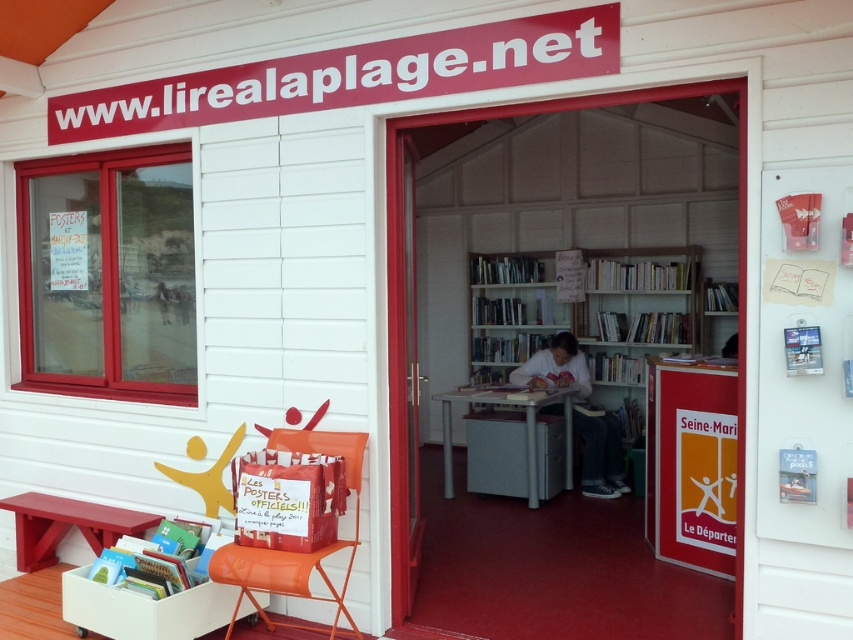
Question: Based on their relative distances, which object is farther from the matte red bench at lower left?

Choices:
 (A) wooden door at center
 (B) red cardboard sign at right
 (C) white wooden bookshelf at center

Answer: (C)

Question: Can you confirm if white wooden bookshelf at center is positioned above red cardboard sign at right?

Choices:
 (A) yes
 (B) no

Answer: (A)

Question: Can you confirm if red cardboard sign at right is positioned to the right of wooden door at center?

Choices:
 (A) no
 (B) yes

Answer: (B)

Question: Estimate the real-world distances between objects in this image. Which object is farther from the red cardboard sign at right?

Choices:
 (A) matte red bench at lower left
 (B) white wooden bookshelf at center

Answer: (A)

Question: Which point is farther to the camera?

Choices:
 (A) matte red bench at lower left
 (B) red cardboard sign at right
 (C) white wooden bookshelf at center
 (D) wooden door at center

Answer: (C)

Question: Considering the relative positions of white wooden bookshelf at center and matte red bench at lower left in the image provided, where is white wooden bookshelf at center located with respect to matte red bench at lower left?

Choices:
 (A) above
 (B) below

Answer: (A)